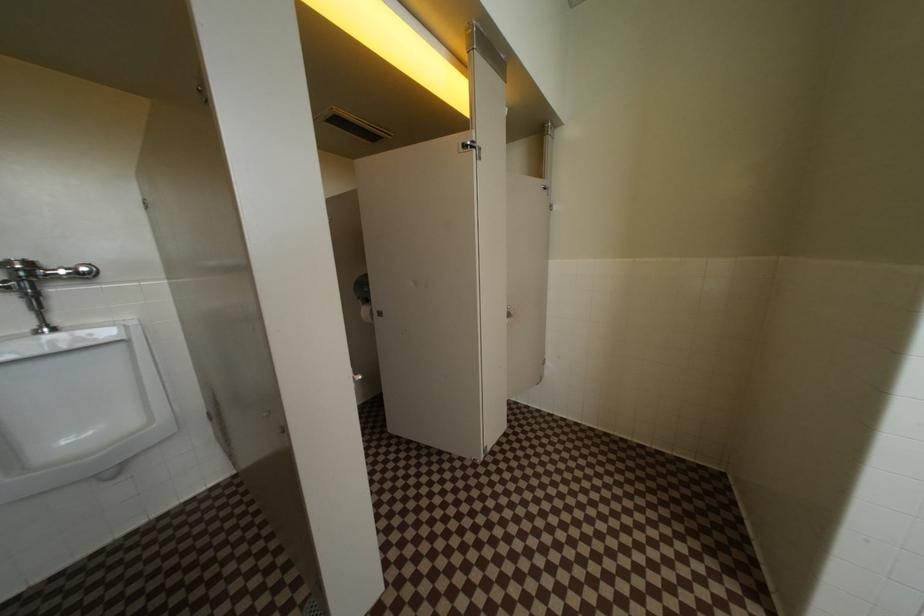
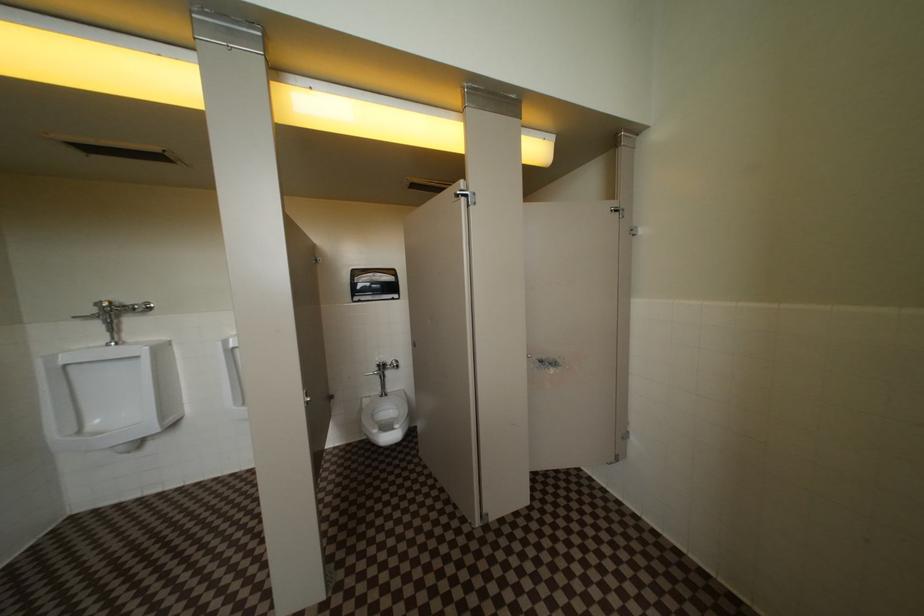
Question: The first image is from the beginning of the video and the second image is from the end. How did the camera likely rotate when shooting the video?

Choices:
 (A) Left
 (B) Right
 (C) Up
 (D) Down

Answer: (A)